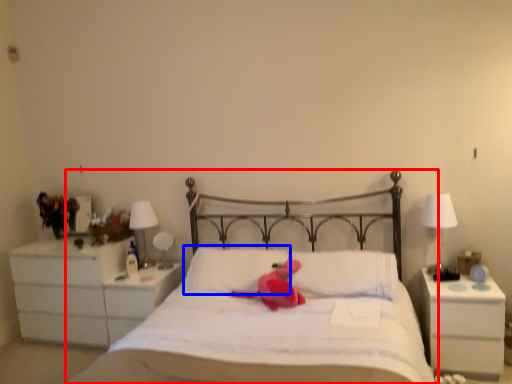
Question: Among these objects, which one is farthest to the camera, bed (highlighted by a red box) or pillow (highlighted by a blue box)?

Choices:
 (A) bed
 (B) pillow

Answer: (B)